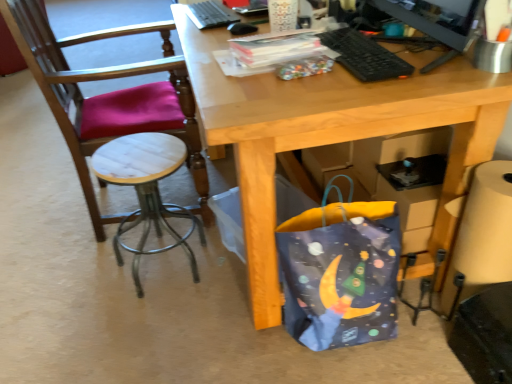
Where is `unoccupied area in front of wooden/marble stool at left`? The width and height of the screenshot is (512, 384). unoccupied area in front of wooden/marble stool at left is located at coordinates (105, 300).